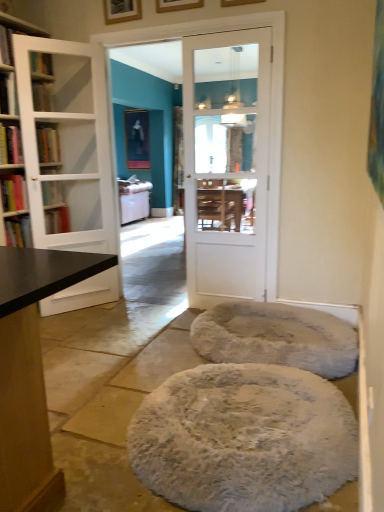
Question: Is wooden picture frame at upper center, the 3th picture frame positioned from the front, far away from hardcover book at left, which is the 2th book from top to bottom?

Choices:
 (A) yes
 (B) no

Answer: (A)

Question: From a real-world perspective, is wooden picture frame at upper center, acting as the 2th picture frame starting from the back, physically below hardcover book at left, which is the 2th book from top to bottom?

Choices:
 (A) yes
 (B) no

Answer: (B)

Question: Does wooden picture frame at upper center, acting as the 2th picture frame starting from the back, have a smaller size compared to hardcover book at left, which is the 2th book from top to bottom?

Choices:
 (A) yes
 (B) no

Answer: (A)

Question: Is wooden picture frame at upper center, marked as the 3th picture frame in a right-to-left arrangement, with hardcover book at left, which is the 2th book from top to bottom?

Choices:
 (A) no
 (B) yes

Answer: (A)

Question: Can you confirm if wooden picture frame at upper center, acting as the 2th picture frame starting from the back, is positioned to the right of hardcover book at left, which is the 2th book from top to bottom?

Choices:
 (A) yes
 (B) no

Answer: (A)

Question: From a real-world perspective, does wooden picture frame at upper center, the 3th picture frame positioned from the front, stand above hardcover book at left, arranged as the third book when ordered from the bottom?

Choices:
 (A) no
 (B) yes

Answer: (B)

Question: Is white glass door at left, the 1th door in the left-to-right sequence, bigger than hardcover book at left, the 2th book in the bottom-to-top sequence?

Choices:
 (A) no
 (B) yes

Answer: (B)

Question: From a real-world perspective, is white glass door at left, which is counted as the second door, starting from the right, positioned over hardcover book at left, the third book from the top, based on gravity?

Choices:
 (A) yes
 (B) no

Answer: (A)

Question: Does white glass door at left, which is counted as the second door, starting from the right, come behind hardcover book at left, the third book from the top?

Choices:
 (A) no
 (B) yes

Answer: (A)

Question: From a real-world perspective, is white glass door at left, the 1th door in the left-to-right sequence, physically below hardcover book at left, the third book from the top?

Choices:
 (A) yes
 (B) no

Answer: (B)

Question: Are white glass door at left, which is counted as the second door, starting from the right, and hardcover book at left, the 2th book in the bottom-to-top sequence, beside each other?

Choices:
 (A) no
 (B) yes

Answer: (A)

Question: Is there a large distance between white glass door at left, which is counted as the second door, starting from the right, and hardcover book at left, the 2th book in the bottom-to-top sequence?

Choices:
 (A) yes
 (B) no

Answer: (B)

Question: Is white glossy door at center, which ranks as the second door in left-to-right order, touching white fluffy pouf at center?

Choices:
 (A) yes
 (B) no

Answer: (B)